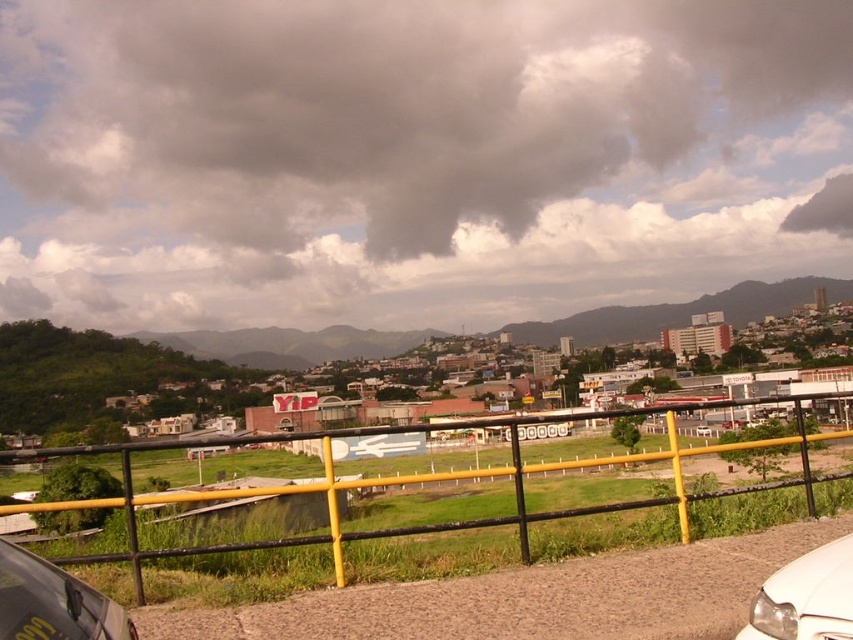
Question: Can you confirm if gray fluffy cloud at upper center is positioned below metallic silver car at lower left?

Choices:
 (A) yes
 (B) no

Answer: (B)

Question: Which of the following is the closest to the observer?

Choices:
 (A) (525, 232)
 (B) (828, 589)

Answer: (B)

Question: Where is gray fluffy cloud at upper center located in relation to yellow metal fence at center in the image?

Choices:
 (A) below
 (B) above

Answer: (B)

Question: Observing the image, what is the correct spatial positioning of gray fluffy cloud at upper center in reference to yellow metal fence at center?

Choices:
 (A) below
 (B) above

Answer: (B)

Question: Estimate the real-world distances between objects in this image. Which object is closer to the gray fluffy cloud at upper center?

Choices:
 (A) metallic silver car at lower left
 (B) yellow metal fence at center
 (C) white glossy car at lower right

Answer: (B)

Question: Which object appears closest to the camera in this image?

Choices:
 (A) yellow metal fence at center
 (B) gray fluffy cloud at upper center
 (C) metallic silver car at lower left
 (D) white glossy car at lower right

Answer: (C)